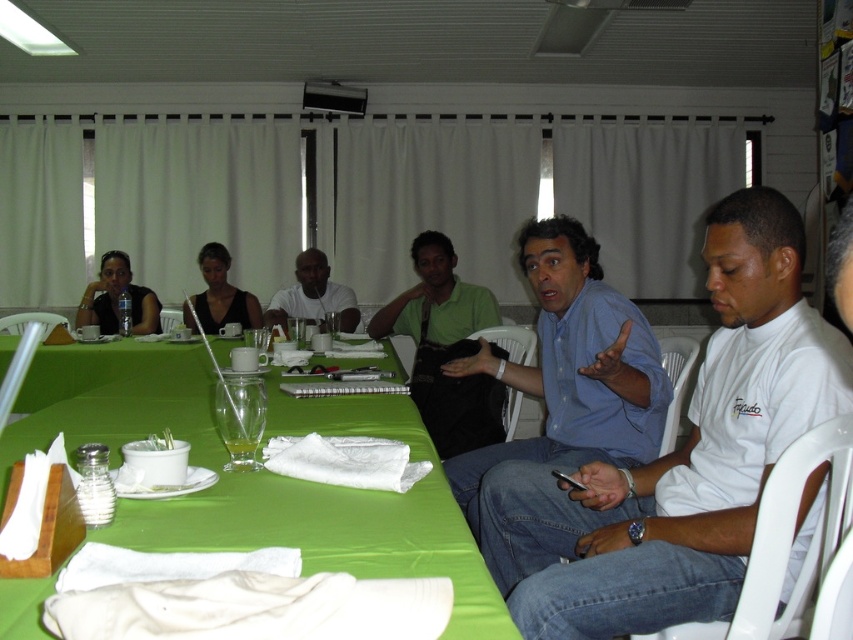
Does blue shirt at center have a lesser width compared to green matte shirt at center?

Correct, blue shirt at center's width is less than green matte shirt at center's.

Does blue shirt at center have a greater height compared to green matte shirt at center?

Yes.

You are a GUI agent. You are given a task and a screenshot of the screen. Output one action in this format:
    pyautogui.click(x=<x>, y=<y>)
    Task: Click on the blue shirt at center
    This screenshot has width=853, height=640.
    Given the screenshot: What is the action you would take?
    point(677,458)

The width and height of the screenshot is (853, 640). What are the coordinates of `blue shirt at center` in the screenshot? It's located at (677, 458).

Is blue shirt at center smaller than transparent glass at center?

No.

Which is behind, point (815, 365) or point (247, 417)?

Point (247, 417)

Where is `blue shirt at center`? This screenshot has width=853, height=640. blue shirt at center is located at coordinates (677, 458).

The height and width of the screenshot is (640, 853). Find the location of `blue shirt at center`. blue shirt at center is located at coordinates (677, 458).

In the scene shown: Measure the distance between blue shirt at center and camera.

The distance of blue shirt at center from camera is 4.11 feet.

Is blue shirt at center above matte black shirt at upper left?

Incorrect, blue shirt at center is not positioned above matte black shirt at upper left.

Between point (483, 516) and point (148, 292), which one is positioned in front?

Point (483, 516)

The height and width of the screenshot is (640, 853). I want to click on blue shirt at center, so click(x=677, y=458).